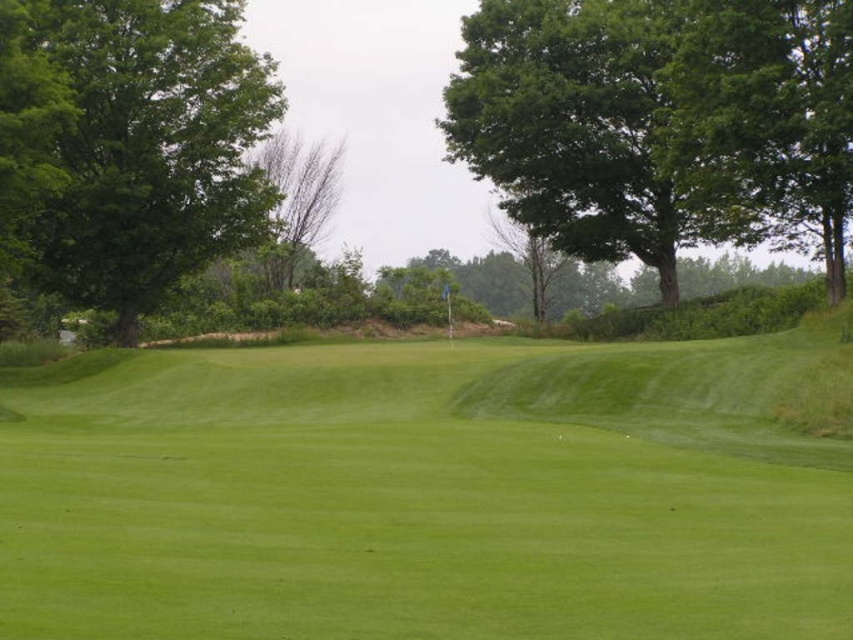
Question: Is green leafy tree at upper right thinner than green leafy tree at left?

Choices:
 (A) no
 (B) yes

Answer: (A)

Question: Which object is the closest to the green leafy tree at upper right?

Choices:
 (A) green leafy tree at left
 (B) green grassy field at center

Answer: (A)

Question: Does green grassy field at center come in front of green leafy tree at upper right?

Choices:
 (A) no
 (B) yes

Answer: (B)

Question: Can you confirm if green grassy field at center is positioned above green leafy tree at left?

Choices:
 (A) yes
 (B) no

Answer: (B)

Question: Among these objects, which one is nearest to the camera?

Choices:
 (A) green leafy tree at upper right
 (B) green grassy field at center
 (C) green leafy tree at left

Answer: (B)

Question: Which point is closer to the camera taking this photo?

Choices:
 (A) [715, 67]
 (B) [47, 572]
 (C) [154, 60]

Answer: (B)